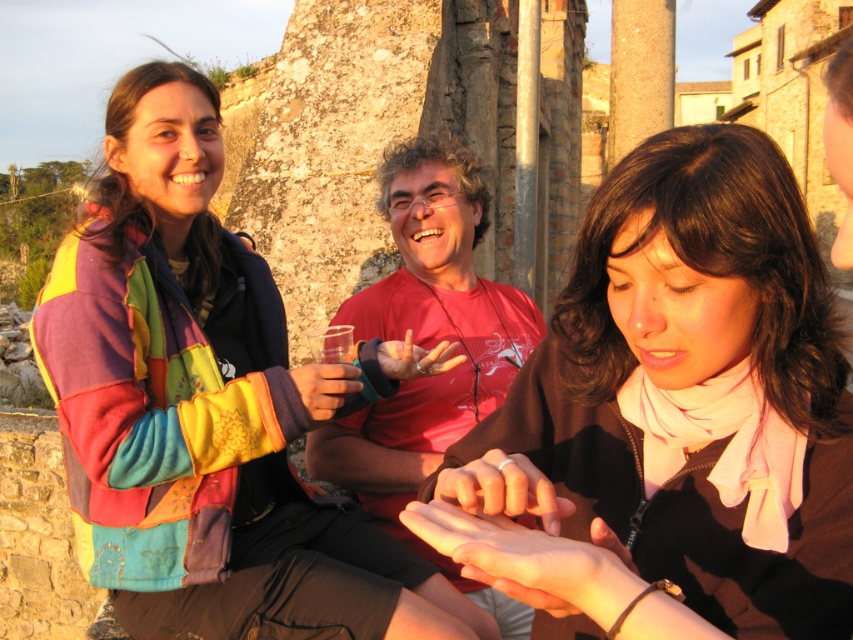
Question: Which object is closer to the camera taking this photo?

Choices:
 (A) brown matte scarf at center
 (B) multicolored fleece jacket at upper left

Answer: (A)

Question: Is multicolored fleece jacket at upper left below brown matte scarf at center?

Choices:
 (A) yes
 (B) no

Answer: (B)

Question: Which of the following is the farthest from the observer?

Choices:
 (A) (62, 364)
 (B) (763, 140)

Answer: (A)

Question: Does multicolored fleece jacket at upper left appear over brown matte scarf at center?

Choices:
 (A) yes
 (B) no

Answer: (A)

Question: Can you confirm if multicolored fleece jacket at upper left is smaller than brown matte scarf at center?

Choices:
 (A) yes
 (B) no

Answer: (B)